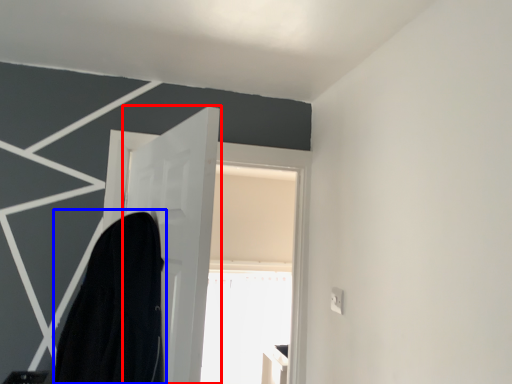
Question: Which object appears farthest to the camera in this image, door (highlighted by a red box) or robe (highlighted by a blue box)?

Choices:
 (A) door
 (B) robe

Answer: (A)